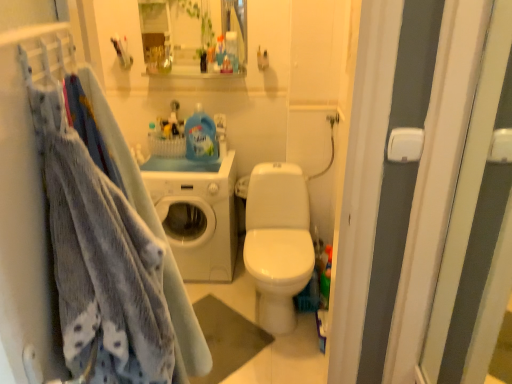
Question: From the image's perspective, relative to white glossy washing machine at center, is soft blue fabric at left above or below?

Choices:
 (A) below
 (B) above

Answer: (A)

Question: Considering the positions of soft blue fabric at left and white glossy washing machine at center in the image, is soft blue fabric at left wider or thinner than white glossy washing machine at center?

Choices:
 (A) thin
 (B) wide

Answer: (A)

Question: Which is nearer to the matte white cabinet at upper center?

Choices:
 (A) white glossy washing machine at center
 (B) soft blue fabric at left

Answer: (A)

Question: Considering the real-world distances, which object is farthest from the soft blue fabric at left?

Choices:
 (A) matte white cabinet at upper center
 (B) white glossy washing machine at center

Answer: (A)